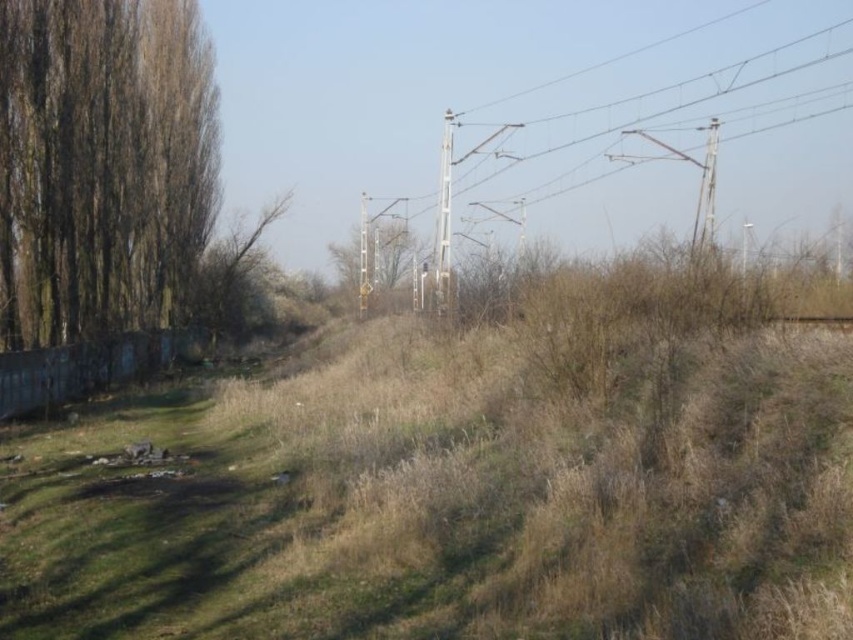
Question: Can you confirm if brown rough bark tree at left is wider than green matte signpost at center?

Choices:
 (A) yes
 (B) no

Answer: (B)

Question: Considering the real-world distances, which object is farthest from the green matte signpost at center?

Choices:
 (A) dry grass at center
 (B) brown rough bark tree at left
 (C) green leafy tree at left

Answer: (A)

Question: Which object is farther from the camera taking this photo?

Choices:
 (A) dry grass at center
 (B) green leafy tree at left
 (C) green matte signpost at center
 (D) brown rough bark tree at left

Answer: (B)

Question: Among these points, which one is farthest from the camera?

Choices:
 (A) (467, 369)
 (B) (383, 256)
 (C) (173, 192)

Answer: (B)

Question: Is brown rough bark tree at left to the right of green leafy tree at left from the viewer's perspective?

Choices:
 (A) no
 (B) yes

Answer: (B)

Question: Does dry grass at center come behind green matte signpost at center?

Choices:
 (A) yes
 (B) no

Answer: (B)